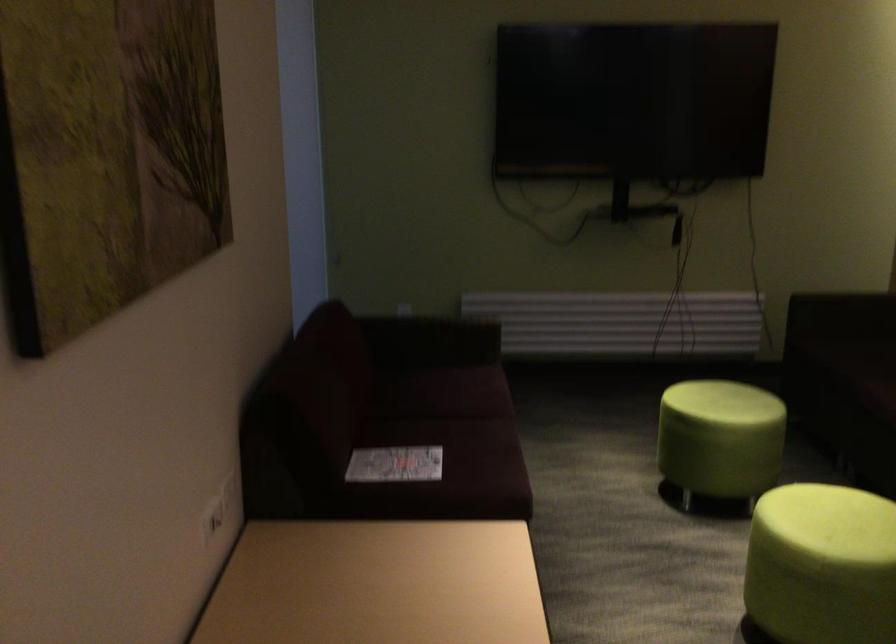
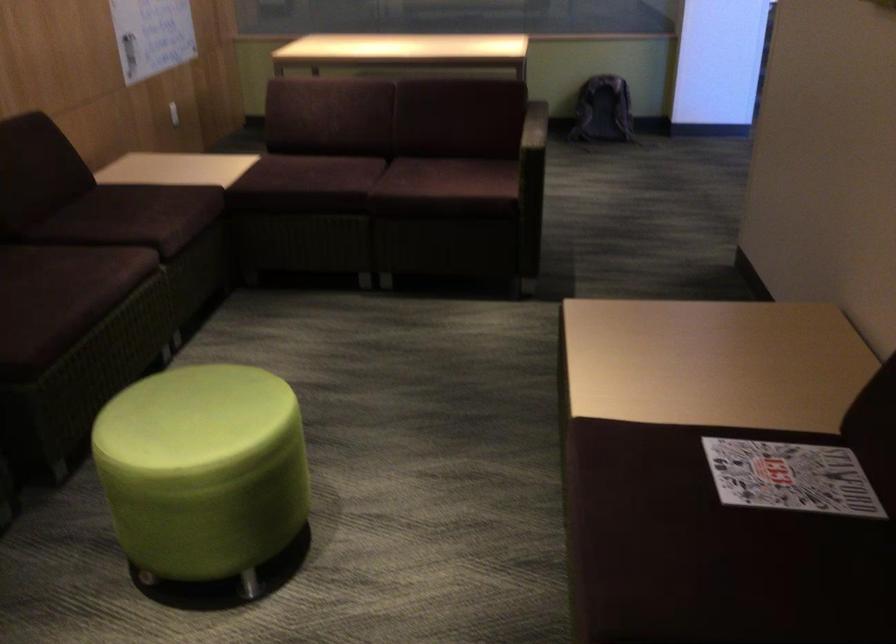
Where in the second image is the point corresponding to pixel 457 436 from the first image?

(712, 573)